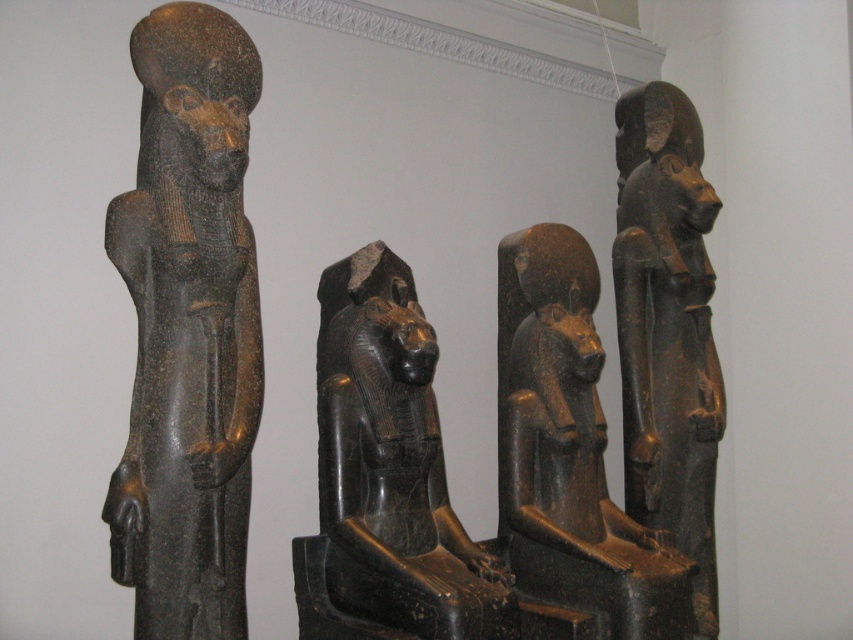
You are a tour guide standing 10 feet away from a group of ancient Egyptian statues. You want to move closer to a specific point marked at coordinates point (219, 292). Can you safely approach this point without getting too close to the statues?

The distance of point (219, 292) from camera is 7.44 feet, so if you are currently 10 feet away, moving to that point would bring you 7.44 feet away from the statues. Since 7.44 feet is still a safe distance, you can approach the point safely.

You are an archaeologist examining the layout of the ancient Egyptian statues. The black stone statue at left is located at coordinates 0.514, 0.222. Can you determine its exact location based on the provided coordinates?

The black stone statue at left is positioned at point (189, 328).